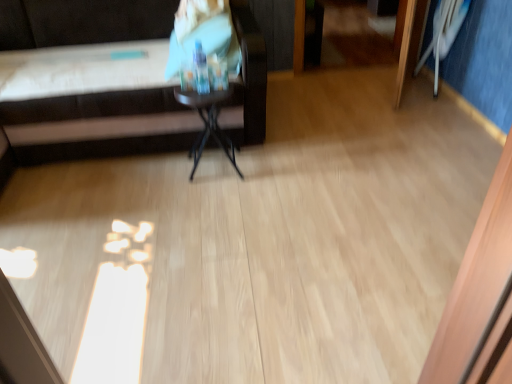
Describe the element at coordinates (444, 33) in the screenshot. I see `white plastic swivel chair at upper right` at that location.

Find the location of a particular element. black glossy side table at center is located at coordinates (208, 123).

What do you see at coordinates (208, 123) in the screenshot?
I see `black glossy side table at center` at bounding box center [208, 123].

Image resolution: width=512 pixels, height=384 pixels. Identify the location of white plastic swivel chair at upper right. (444, 33).

From the picture: Is black glossy side table at center shorter than white plastic swivel chair at upper right?

Yes.

Choose the correct answer: Is black glossy side table at center inside white plastic swivel chair at upper right or outside it?

black glossy side table at center exists outside the volume of white plastic swivel chair at upper right.

From a real-world perspective, is black glossy side table at center above or below white plastic swivel chair at upper right?

black glossy side table at center is below white plastic swivel chair at upper right.

Locate an element on the screen. The image size is (512, 384). side table below the matte plastic bottle at upper center (from the image's perspective) is located at coordinates (208, 123).

Does matte plastic bottle at upper center have a greater width compared to black glossy side table at center?

Indeed, matte plastic bottle at upper center has a greater width compared to black glossy side table at center.

Can black glossy side table at center be found inside matte plastic bottle at upper center?

No, black glossy side table at center is located outside of matte plastic bottle at upper center.

How much distance is there between matte plastic bottle at upper center and black glossy side table at center?

They are 39.99 centimeters apart.

Consider the image. Is white plastic swivel chair at upper right next to brown leather couch at upper left?

white plastic swivel chair at upper right and brown leather couch at upper left are not in contact.

Relative to brown leather couch at upper left, is white plastic swivel chair at upper right in front or behind?

Visually, white plastic swivel chair at upper right is located behind brown leather couch at upper left.

Considering the sizes of white plastic swivel chair at upper right and brown leather couch at upper left in the image, is white plastic swivel chair at upper right taller or shorter than brown leather couch at upper left?

Clearly, white plastic swivel chair at upper right is shorter compared to brown leather couch at upper left.

Looking at this image, is white plastic swivel chair at upper right positioned with its back to brown leather couch at upper left?

white plastic swivel chair at upper right does not have its back to brown leather couch at upper left.

Considering the relative sizes of black glossy side table at center and matte plastic bottle at upper center in the image provided, is black glossy side table at center shorter than matte plastic bottle at upper center?

No, black glossy side table at center is not shorter than matte plastic bottle at upper center.

Which is behind, point (220, 128) or point (224, 45)?

The point (220, 128) is behind.

Is brown leather couch at upper left to the right of black glossy side table at center from the viewer's perspective?

No, brown leather couch at upper left is not to the right of black glossy side table at center.

Is the position of brown leather couch at upper left more distant than that of black glossy side table at center?

No, the depth of brown leather couch at upper left is less than that of black glossy side table at center.

Could matte plastic bottle at upper center be considered to be inside white plastic swivel chair at upper right?

Definitely not — matte plastic bottle at upper center is not inside white plastic swivel chair at upper right.

Is point (451, 42) positioned in front of point (183, 1)?

No, (451, 42) is further to viewer.

Where is `person on the left of white plastic swivel chair at upper right`? The height and width of the screenshot is (384, 512). person on the left of white plastic swivel chair at upper right is located at coordinates (203, 34).

How many degrees apart are the facing directions of white plastic swivel chair at upper right and matte plastic bottle at upper center?

The facing directions of white plastic swivel chair at upper right and matte plastic bottle at upper center are 1.8 degrees apart.

From the image's perspective, is black glossy side table at center beneath brown leather couch at upper left?

Correct, black glossy side table at center appears lower than brown leather couch at upper left in the image.

Is black glossy side table at center oriented away from brown leather couch at upper left?

Correct, black glossy side table at center is looking away from brown leather couch at upper left.

Which of these two, black glossy side table at center or brown leather couch at upper left, stands taller?

brown leather couch at upper left.

Considering the sizes of black glossy side table at center and brown leather couch at upper left in the image, is black glossy side table at center wider or thinner than brown leather couch at upper left?

Clearly, black glossy side table at center has less width compared to brown leather couch at upper left.

Locate an element on the screen. This screenshot has width=512, height=384. side table that appears in front of the white plastic swivel chair at upper right is located at coordinates coord(208,123).

The image size is (512, 384). What are the coordinates of `side table located below the matte plastic bottle at upper center (from the image's perspective)` in the screenshot? It's located at (208, 123).

Which object lies further to the anchor point matte plastic bottle at upper center, brown leather couch at upper left or black glossy side table at center?

black glossy side table at center is further to matte plastic bottle at upper center.

Based on the photo, estimate the real-world distances between objects in this image. Which object is further from brown leather couch at upper left, white plastic swivel chair at upper right or black glossy side table at center?

white plastic swivel chair at upper right is further to brown leather couch at upper left.

Based on their spatial positions, is white plastic swivel chair at upper right or brown leather couch at upper left further from black glossy side table at center?

white plastic swivel chair at upper right is positioned further to the anchor black glossy side table at center.

Considering their positions, is brown leather couch at upper left positioned further to white plastic swivel chair at upper right than matte plastic bottle at upper center?

brown leather couch at upper left lies further to white plastic swivel chair at upper right than the other object.

Which object lies nearer to the anchor point brown leather couch at upper left, black glossy side table at center or white plastic swivel chair at upper right?

black glossy side table at center lies closer to brown leather couch at upper left than the other object.

Estimate the real-world distances between objects in this image. Which object is closer to white plastic swivel chair at upper right, black glossy side table at center or matte plastic bottle at upper center?

matte plastic bottle at upper center.

Considering their positions, is black glossy side table at center positioned further to brown leather couch at upper left than matte plastic bottle at upper center?

Based on the image, matte plastic bottle at upper center appears to be further to brown leather couch at upper left.

Considering their positions, is matte plastic bottle at upper center positioned further to brown leather couch at upper left than black glossy side table at center?

The object further to brown leather couch at upper left is matte plastic bottle at upper center.

Locate an element on the screen. This screenshot has height=384, width=512. side table between brown leather couch at upper left and white plastic swivel chair at upper right is located at coordinates (208, 123).

Locate an element on the screen. side table between matte plastic bottle at upper center and white plastic swivel chair at upper right is located at coordinates (208, 123).

This screenshot has width=512, height=384. In order to click on person situated between brown leather couch at upper left and black glossy side table at center from left to right in this screenshot , I will do `click(203, 34)`.

Identify the location of person situated between brown leather couch at upper left and white plastic swivel chair at upper right from left to right. The width and height of the screenshot is (512, 384). (203, 34).